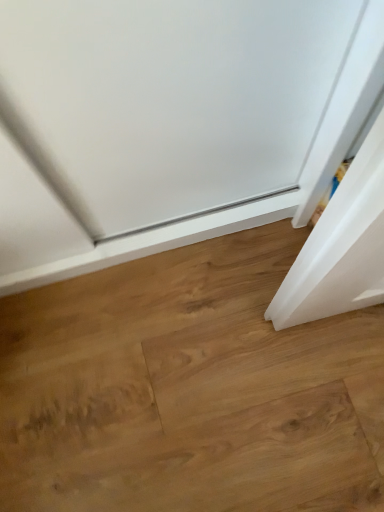
Image resolution: width=384 pixels, height=512 pixels. In order to click on natural wood flooring at center in this screenshot , I will do `click(189, 389)`.

This screenshot has height=512, width=384. What do you see at coordinates (189, 389) in the screenshot?
I see `natural wood flooring at center` at bounding box center [189, 389].

In order to face natural wood flooring at center, should I rotate leftwards or rightwards?

Rotate right and turn 3.181 degrees.

Find the location of a particular element. This screenshot has width=384, height=512. natural wood flooring at center is located at coordinates (189, 389).